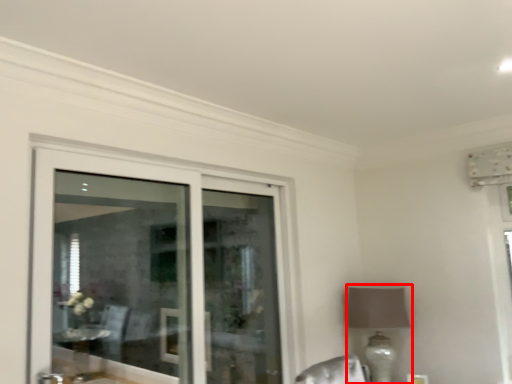
Question: From the image's perspective, where is table lamp (annotated by the red box) located in relation to door in the image?

Choices:
 (A) above
 (B) below

Answer: (B)